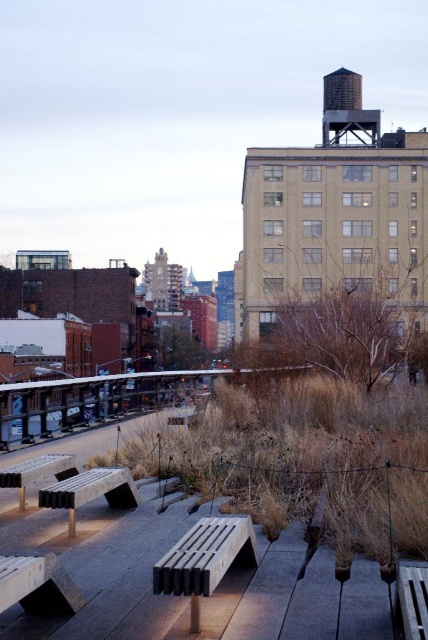
Question: Estimate the real-world distances between objects in this image. Which object is closer to the matte white picnic table at lower left?

Choices:
 (A) wooden bench at lower center
 (B) wooden park bench at lower right
 (C) wooden bench at lower left
 (D) brown concrete water tower at upper center

Answer: (C)

Question: Is wooden slats bench at center to the left of matte white picnic table at lower left from the viewer's perspective?

Choices:
 (A) yes
 (B) no

Answer: (B)

Question: Which is farther from the wooden park bench at lower right?

Choices:
 (A) wooden bench at lower left
 (B) matte white picnic table at lower left
 (C) matte gray bench at center

Answer: (B)

Question: Which object is closer to the camera taking this photo?

Choices:
 (A) wooden bench at lower center
 (B) wooden slats bench at center
 (C) matte white picnic table at lower left
 (D) matte gray bench at center

Answer: (B)

Question: Observing the image, what is the correct spatial positioning of wooden slats bench at center in reference to matte white picnic table at lower left?

Choices:
 (A) left
 (B) right

Answer: (B)

Question: Observing the image, what is the correct spatial positioning of wooden slats bench at center in reference to brown concrete water tower at upper center?

Choices:
 (A) above
 (B) below

Answer: (B)